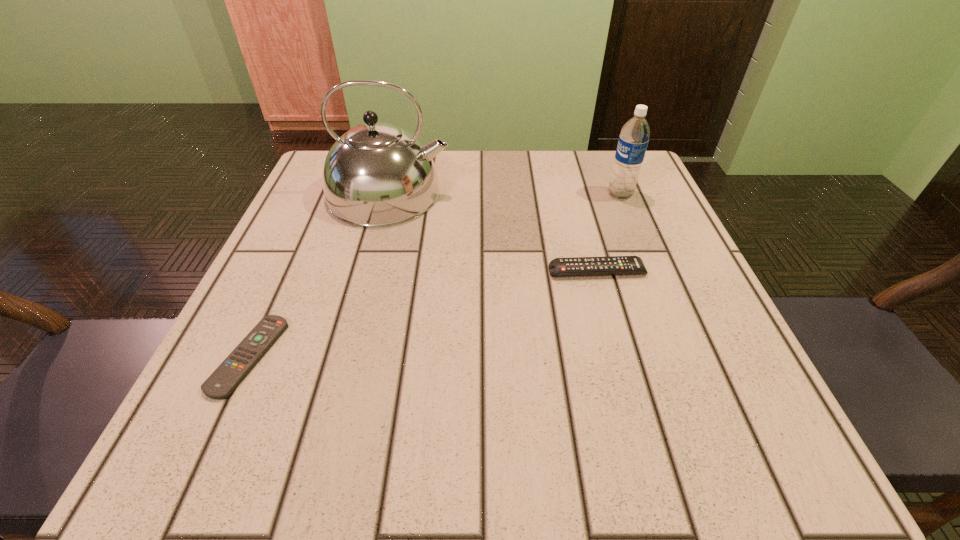
This screenshot has width=960, height=540. In the image, there is a desktop. What are the coordinates of `vacant space at the right edge` in the screenshot? It's located at (619, 210).

This screenshot has width=960, height=540. In the image, there is a desktop. What are the coordinates of `vacant space at the far left corner` in the screenshot? It's located at (323, 186).

Image resolution: width=960 pixels, height=540 pixels. In the image, there is a desktop. What are the coordinates of `vacant region at the far right corner` in the screenshot? It's located at (588, 152).

Find the location of `vacant space at the near right corner of the desktop`. vacant space at the near right corner of the desktop is located at coordinates (756, 410).

Where is `free spot between the kettle and the water bottle`? The height and width of the screenshot is (540, 960). free spot between the kettle and the water bottle is located at coordinates (505, 194).

Identify the location of vacant space that's between the second tallest object and the nearer remote control. (435, 275).

In order to click on unoccupied position between the second tallest object and the tallest object in this screenshot , I will do `click(505, 194)`.

The image size is (960, 540). I want to click on free space between the second nearest object and the kettle, so [493, 232].

Where is `empty space that is in between the second tallest object and the second nearest object`? The image size is (960, 540). empty space that is in between the second tallest object and the second nearest object is located at coordinates (609, 233).

Where is `free spot between the farther remote control and the second tallest object`? free spot between the farther remote control and the second tallest object is located at coordinates (609, 233).